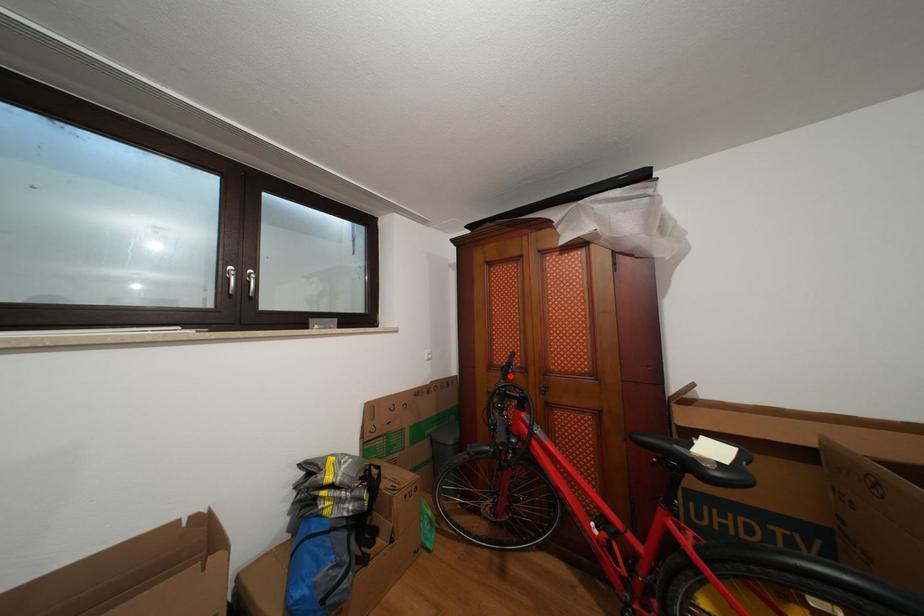
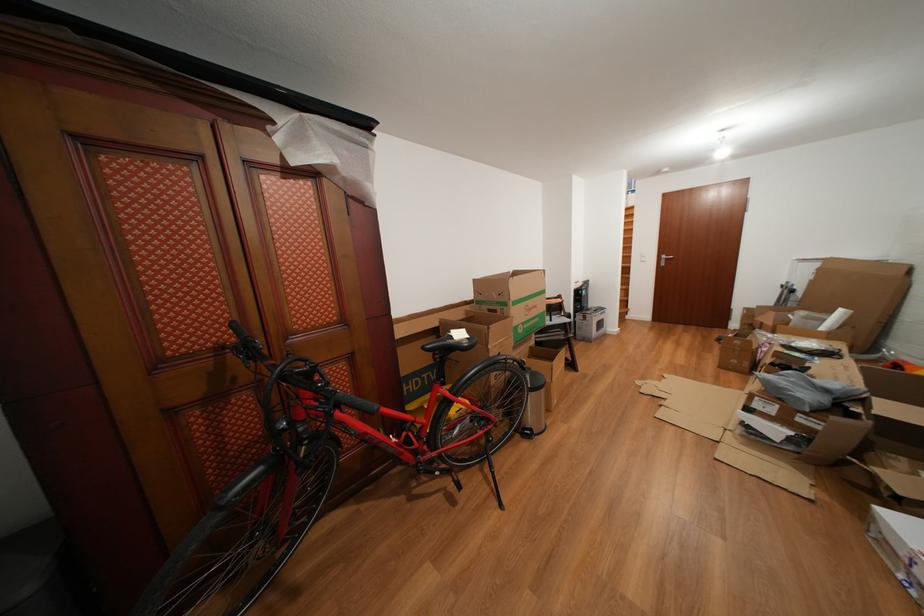
Locate, in the second image, the point that corresponds to the highlighted location in the first image.

(248, 358)